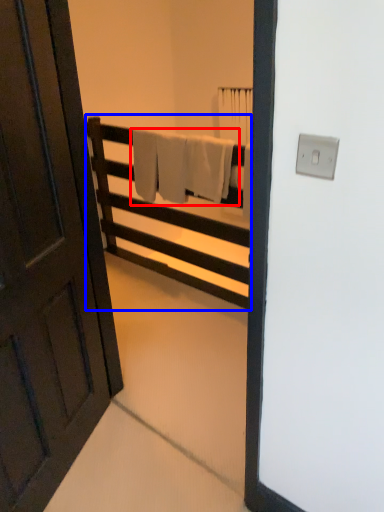
Question: Which point is closer to the camera, bath towel (highlighted by a red box) or furniture (highlighted by a blue box)?

Choices:
 (A) bath towel
 (B) furniture

Answer: (B)